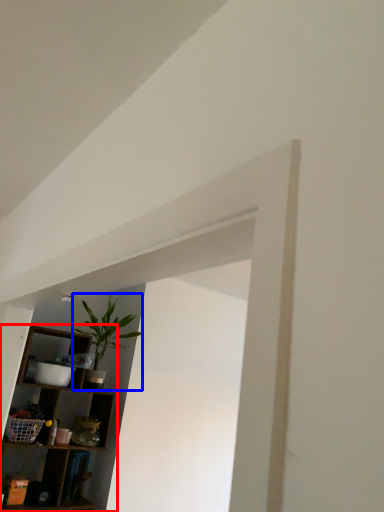
Question: Which object is closer to the camera taking this photo, shelf (highlighted by a red box) or houseplant (highlighted by a blue box)?

Choices:
 (A) shelf
 (B) houseplant

Answer: (A)